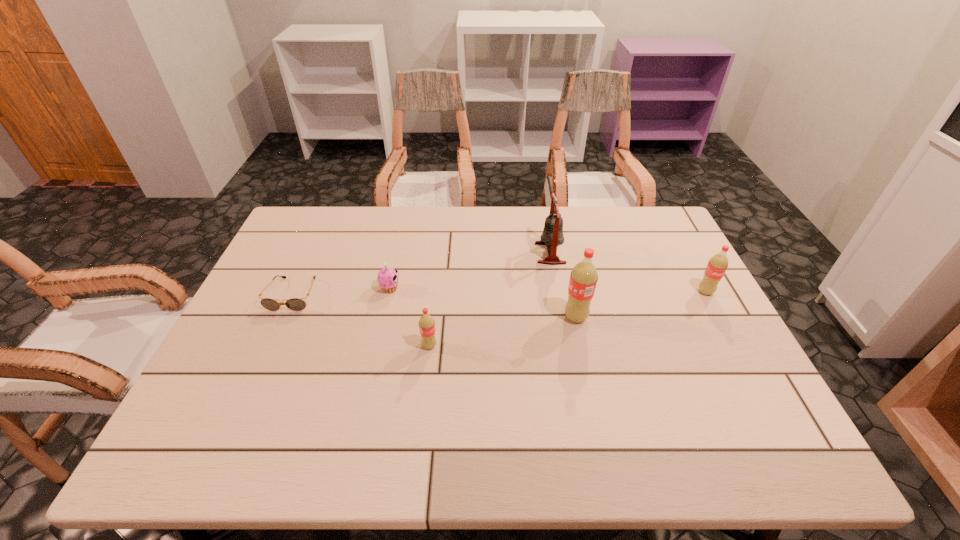
What are the coordinates of `object at the right edge` in the screenshot? It's located at (717, 265).

You are a GUI agent. You are given a task and a screenshot of the screen. Output one action in this format:
    pyautogui.click(x=<x>, y=<y>)
    Task: Click on the free space at the far edge of the desktop
    The width and height of the screenshot is (960, 540).
    Given the screenshot: What is the action you would take?
    pyautogui.click(x=391, y=248)

Identify the location of vacant space at the near edge of the desktop. (340, 410).

The height and width of the screenshot is (540, 960). Find the location of `blank area at the left edge`. blank area at the left edge is located at coordinates (251, 303).

Where is `vacant space at the right edge`? Image resolution: width=960 pixels, height=540 pixels. vacant space at the right edge is located at coordinates (684, 261).

Where is `vacant space at the far left corner of the desktop`? vacant space at the far left corner of the desktop is located at coordinates (328, 208).

At what (x,y) coordinates should I click in order to perform the action: click on vacant space at the far right corner of the desktop. Please return your answer as a coordinate pair (x, y). The height and width of the screenshot is (540, 960). Looking at the image, I should click on (658, 246).

You are a GUI agent. You are given a task and a screenshot of the screen. Output one action in this format:
    pyautogui.click(x=<x>, y=<y>)
    Task: Click on the vacant area that lies between the second object from left to right and the second soda from right to left
    
    Given the screenshot: What is the action you would take?
    pyautogui.click(x=483, y=303)

Locate an element on the screen. vacant area between the bell and the tallest soda is located at coordinates (564, 285).

Image resolution: width=960 pixels, height=540 pixels. Find the location of `free spot between the second shortest object and the rightmost object`. free spot between the second shortest object and the rightmost object is located at coordinates (548, 290).